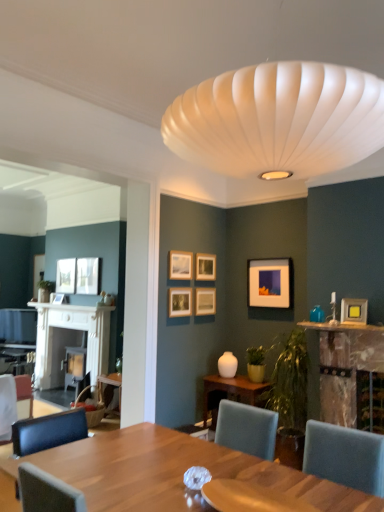
In order to click on free location in front of matte yellow picture frame at upper right, marked as the first picture frame in a right-to-left arrangement in this screenshot , I will do `click(360, 327)`.